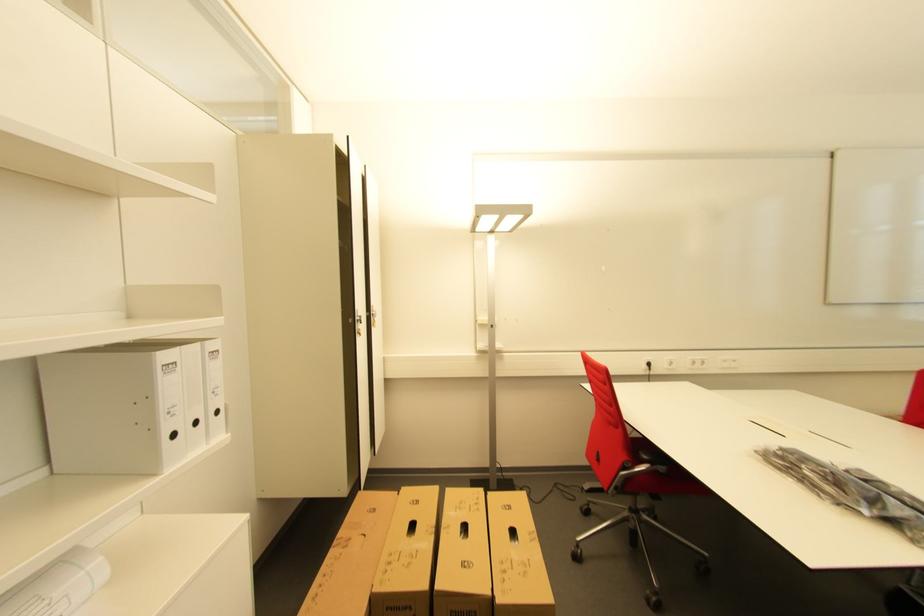
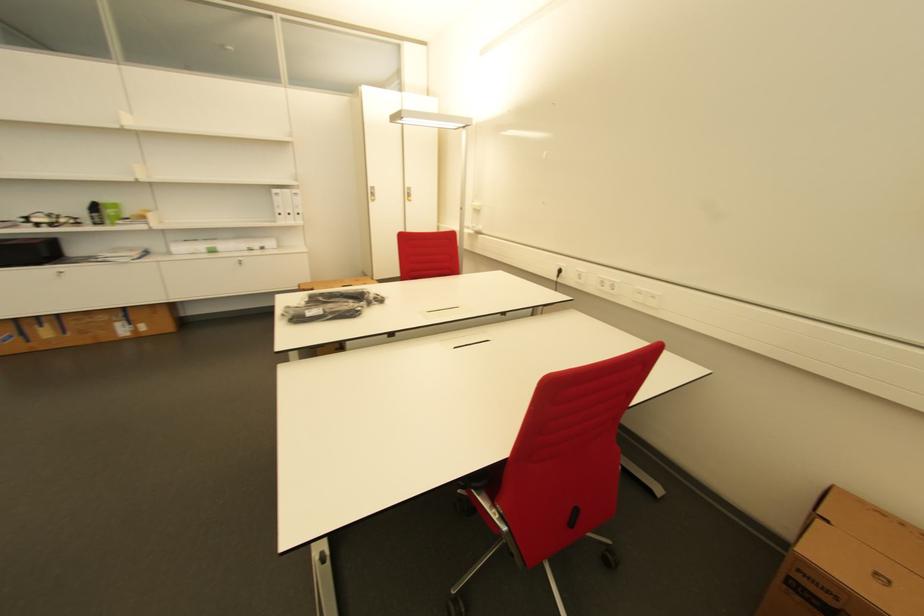
The point at (201, 424) is marked in the first image. Where is the corresponding point in the second image?

(294, 216)